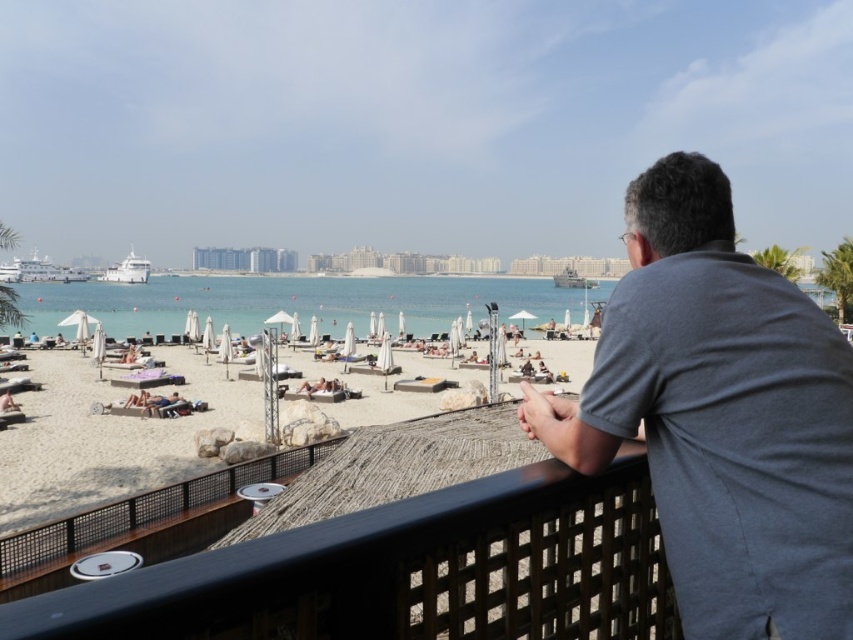
Question: Which of the following is the farthest from the observer?

Choices:
 (A) gray cotton shirt at upper right
 (B) tan skin person at lower left
 (C) beige sand beach at center
 (D) clear blue water at center

Answer: (B)

Question: From the image, what is the correct spatial relationship of clear blue water at center in relation to tan skin person at lower left?

Choices:
 (A) left
 (B) right

Answer: (A)

Question: Is beige sand beach at center below tan skin person at lower left?

Choices:
 (A) no
 (B) yes

Answer: (A)

Question: Which point is closer to the camera taking this photo?

Choices:
 (A) (474, 420)
 (B) (260, 291)
 (C) (10, 406)

Answer: (A)

Question: Among these points, which one is nearest to the camera?

Choices:
 (A) (798, 513)
 (B) (440, 465)
 (C) (9, 403)

Answer: (A)

Question: Can you confirm if clear blue water at center is positioned below tan skin person at lower left?

Choices:
 (A) no
 (B) yes

Answer: (A)